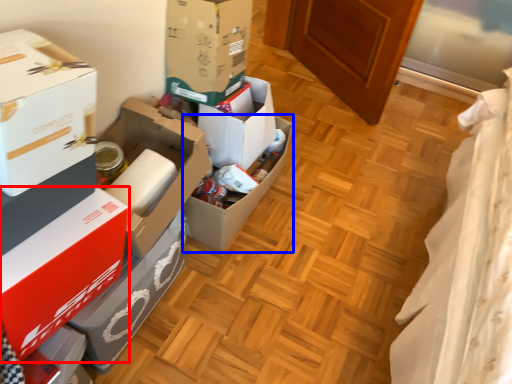
Question: Which of the following is the farthest to the observer, box (highlighted by a red box) or box (highlighted by a blue box)?

Choices:
 (A) box
 (B) box

Answer: (B)